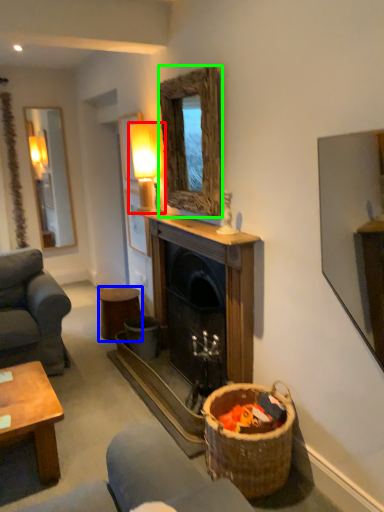
Question: Based on their relative distances, which object is nearer to lamp (highlighted by a red box)? Choose from stool (highlighted by a blue box) and mirror (highlighted by a green box).

Choices:
 (A) stool
 (B) mirror

Answer: (B)